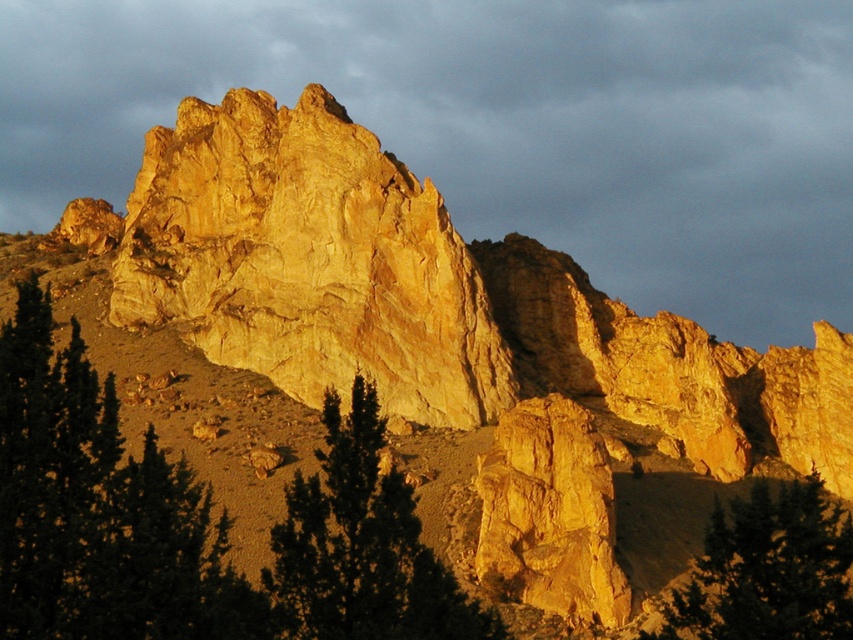
Question: Is green matte tree at lower left behind green matte tree at lower right?

Choices:
 (A) no
 (B) yes

Answer: (A)

Question: Among these points, which one is nearest to the camera?

Choices:
 (A) (447, 593)
 (B) (190, 173)
 (C) (816, 557)
 (D) (625, 205)

Answer: (A)

Question: Does green matte tree at lower left come behind green matte tree at lower right?

Choices:
 (A) yes
 (B) no

Answer: (B)

Question: Which object appears farthest from the camera in this image?

Choices:
 (A) yellow sandstone rock at center
 (B) yellow rock formation at upper center

Answer: (B)

Question: Can you confirm if yellow rock formation at upper center is positioned to the right of yellow sandstone rock at center?

Choices:
 (A) no
 (B) yes

Answer: (B)

Question: Which point is farther from the camera taking this photo?

Choices:
 (A) (380, 106)
 (B) (830, 532)
 (C) (468, 596)
 (D) (103, 504)

Answer: (A)